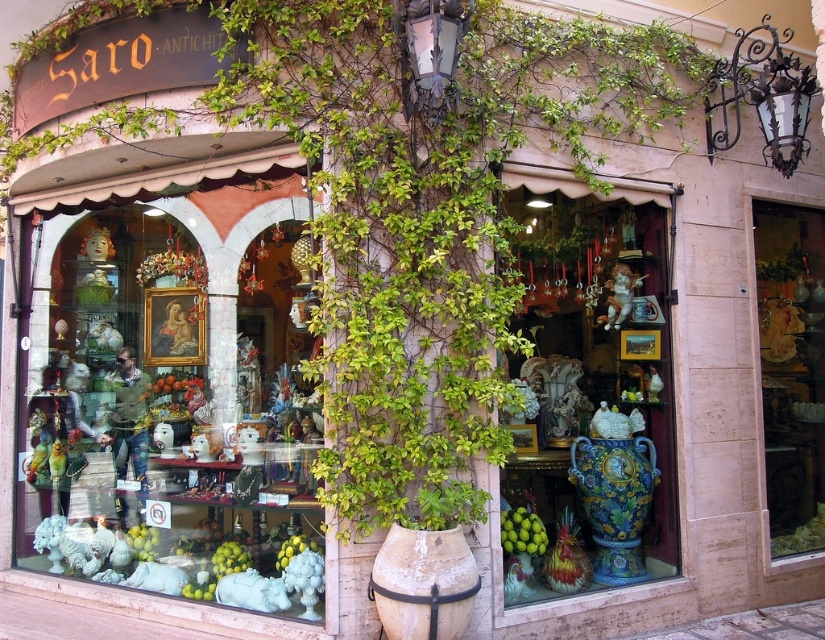
Question: Does black wrought iron lamp at upper right appear over multicolored ceramic vase at center?

Choices:
 (A) yes
 (B) no

Answer: (A)

Question: Which point is closer to the camera taking this photo?

Choices:
 (A) (767, 112)
 (B) (813, 381)
 (C) (305, 268)

Answer: (C)

Question: Which point is farther from the camera taking this photo?

Choices:
 (A) (297, 253)
 (B) (625, 506)
 (C) (759, 72)

Answer: (C)

Question: Is black wrought iron lamp at upper right thinner than white earthenware vase at center?

Choices:
 (A) no
 (B) yes

Answer: (A)

Question: Which object is closer to the camera taking this photo?

Choices:
 (A) white earthenware vase at center
 (B) multicolored ceramic vase at center
 (C) blue ceramic vase at center
 (D) matte white statue at center

Answer: (A)

Question: Does white earthenware vase at center have a lesser width compared to multicolored ceramic vase at center?

Choices:
 (A) yes
 (B) no

Answer: (B)